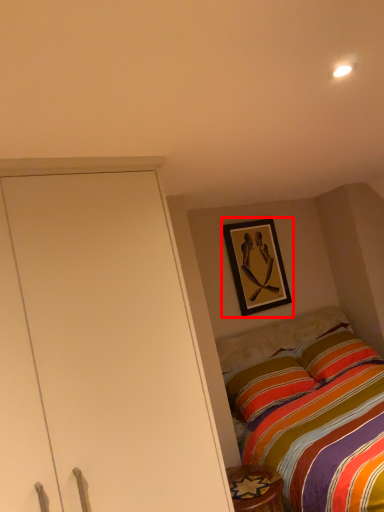
Question: Observing the image, what is the correct spatial positioning of picture frame (annotated by the red box) in reference to furniture?

Choices:
 (A) left
 (B) right

Answer: (B)